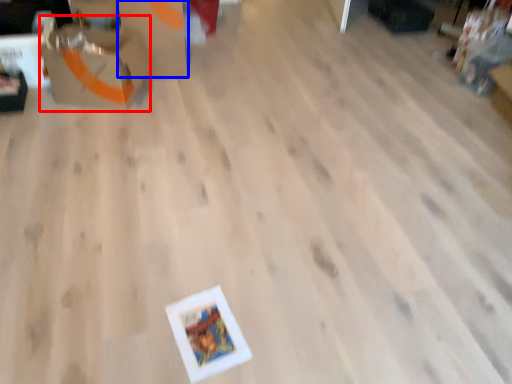
Question: Which object appears farthest to the camera in this image, cardboard box (highlighted by a red box) or cardboard box (highlighted by a blue box)?

Choices:
 (A) cardboard box
 (B) cardboard box

Answer: (B)